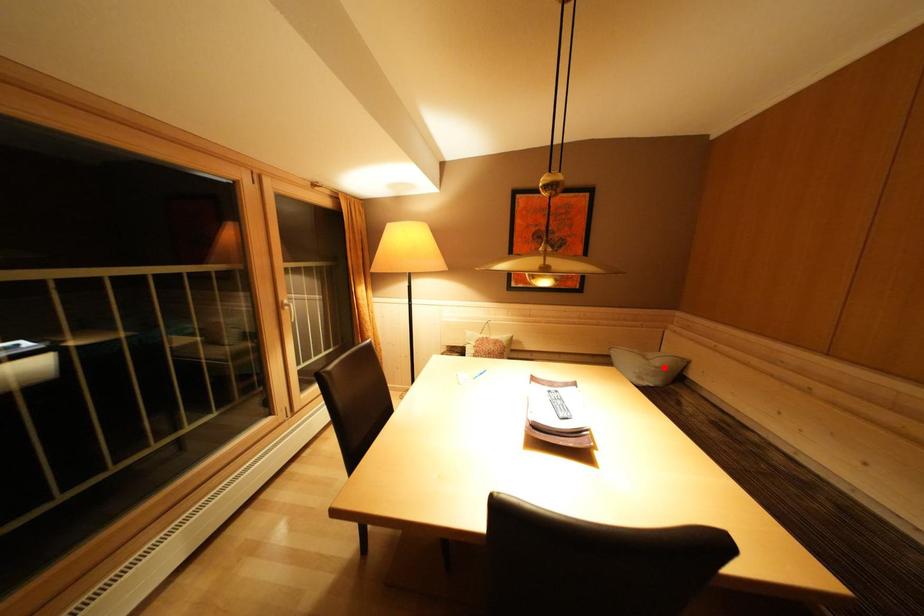
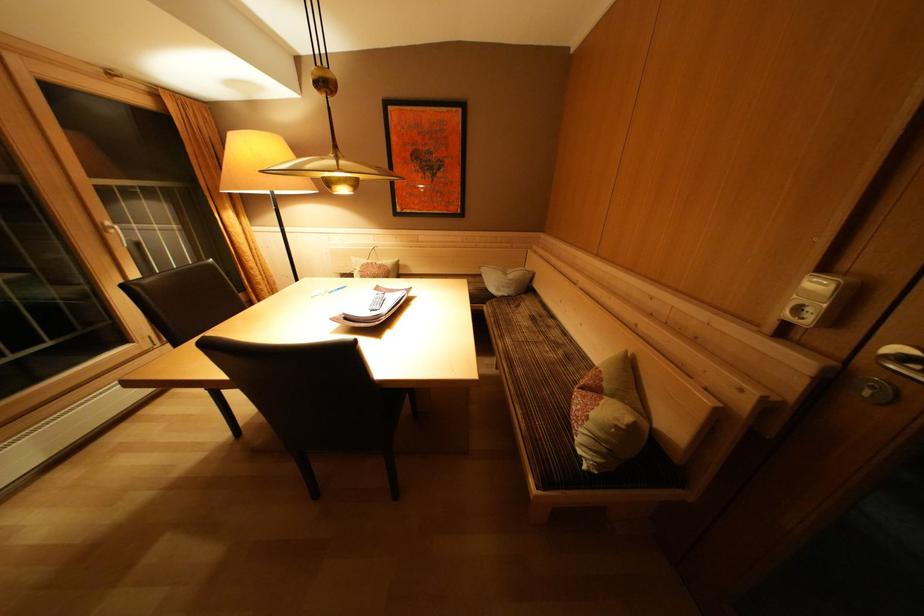
Question: I am providing you with two images of the same scene from different viewpoints. A red point is shown in image1. For the corresponding object point in image2, is it positioned nearer or farther from the camera?

Choices:
 (A) Nearer
 (B) Farther

Answer: (A)